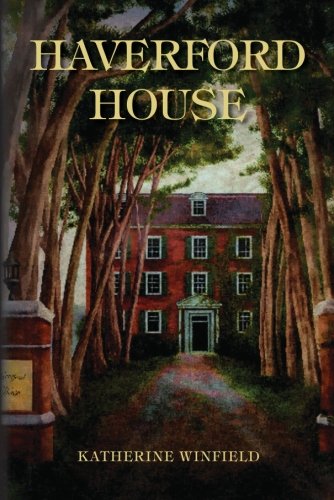
Image resolution: width=334 pixels, height=500 pixels. Identify the location of front door. (199, 334).